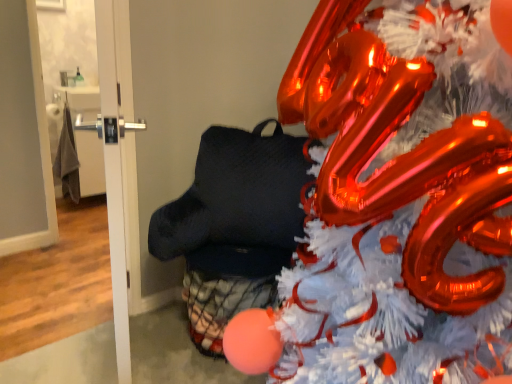
Question: Is the position of shiny metallic christmas tree at center more distant than that of white glossy door at upper left, arranged as the second door when viewed from the right?

Choices:
 (A) no
 (B) yes

Answer: (A)

Question: From a real-world perspective, is shiny metallic christmas tree at center beneath white glossy door at upper left, arranged as the 1th door when viewed from the left?

Choices:
 (A) yes
 (B) no

Answer: (B)

Question: Does shiny metallic christmas tree at center have a larger size compared to white glossy door at upper left, arranged as the second door when viewed from the right?

Choices:
 (A) yes
 (B) no

Answer: (A)

Question: From the image's perspective, is shiny metallic christmas tree at center on top of white glossy door at upper left, arranged as the second door when viewed from the right?

Choices:
 (A) yes
 (B) no

Answer: (B)

Question: From the image's perspective, is shiny metallic christmas tree at center located beneath white glossy door at upper left, arranged as the 1th door when viewed from the left?

Choices:
 (A) yes
 (B) no

Answer: (A)

Question: Is shiny metallic christmas tree at center looking in the opposite direction of white glossy door at upper left, arranged as the 1th door when viewed from the left?

Choices:
 (A) yes
 (B) no

Answer: (B)

Question: Is white glossy door at left, placed as the 2th door when sorted from left to right, wider than white glossy door at upper left, arranged as the second door when viewed from the right?

Choices:
 (A) yes
 (B) no

Answer: (A)

Question: Does white glossy door at left, placed as the 2th door when sorted from left to right, have a lesser width compared to white glossy door at upper left, arranged as the 1th door when viewed from the left?

Choices:
 (A) no
 (B) yes

Answer: (A)

Question: Considering the relative sizes of white glossy door at left, acting as the 1th door starting from the right, and white glossy door at upper left, arranged as the second door when viewed from the right, in the image provided, is white glossy door at left, acting as the 1th door starting from the right, smaller than white glossy door at upper left, arranged as the second door when viewed from the right,?

Choices:
 (A) yes
 (B) no

Answer: (B)

Question: Does white glossy door at left, acting as the 1th door starting from the right, come behind white glossy door at upper left, arranged as the second door when viewed from the right?

Choices:
 (A) yes
 (B) no

Answer: (B)

Question: Considering the relative positions of white glossy door at left, placed as the 2th door when sorted from left to right, and white glossy door at upper left, arranged as the second door when viewed from the right, in the image provided, is white glossy door at left, placed as the 2th door when sorted from left to right, to the right of white glossy door at upper left, arranged as the second door when viewed from the right, from the viewer's perspective?

Choices:
 (A) yes
 (B) no

Answer: (A)

Question: From a real-world perspective, is white glossy door at left, placed as the 2th door when sorted from left to right, under white glossy door at upper left, arranged as the 1th door when viewed from the left?

Choices:
 (A) yes
 (B) no

Answer: (B)

Question: Is shiny metallic christmas tree at center completely or partially outside of white glossy door at left, acting as the 1th door starting from the right?

Choices:
 (A) yes
 (B) no

Answer: (A)